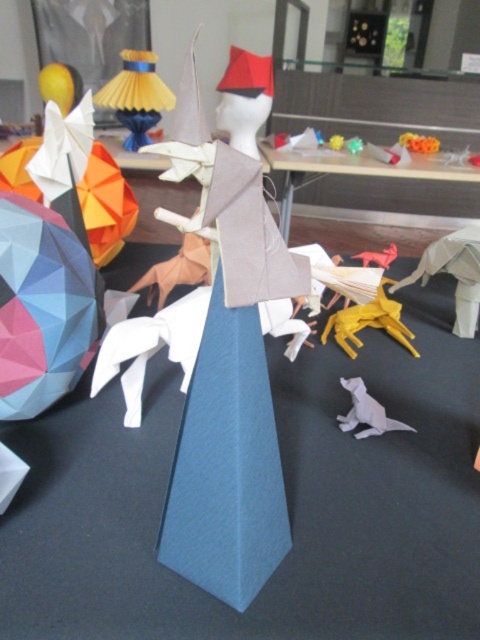
Is the position of wooden table at center less distant than that of yellow paper horse at center?

No, wooden table at center is behind yellow paper horse at center.

You are a GUI agent. You are given a task and a screenshot of the screen. Output one action in this format:
    pyautogui.click(x=<x>, y=<y>)
    Task: Click on the wooden table at center
    The width and height of the screenshot is (480, 640).
    Given the screenshot: What is the action you would take?
    pyautogui.click(x=352, y=172)